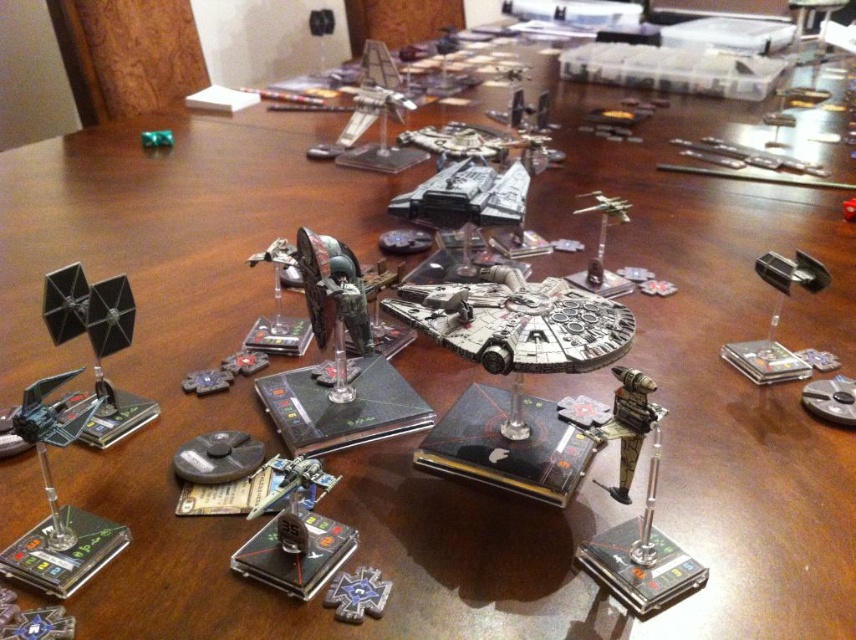
You are a player in a tabletop game who wants to move your metallic silver starfighter at upper right closer to the metallic silver star at center. The game rules state that each turn, your starfighter can move up to 0.5 meters. How many turns will it take to reach the star?

The metallic silver star at center and metallic silver starfighter at upper right are 1.06 meters apart from each other. Since the starfighter can move 0.5 meters per turn, it would take 3 turns to cover the distance. After 2 turns, it would have moved 1.0 meters, leaving 0.06 meters remaining, requiring a third turn to reach the star.

Based on the photo, you are a player in a Star Wars miniature game. Your metallic silver spaceship at lower left is positioned at coordinates 0.692, 0.061. If you want to move it to the center of the table, which direction should you move it?

The metallic silver spaceship at lower left is currently at coordinates (51,442). To move it to the center of the table, you should move it in the direction towards the upper center.

You are a player in a Star Wars tabletop game. Your spaceship, the metallic silver spaceship at lower left, is located at coordinates 0.692, 0.061. The game requires you to move your ship to the nearest corner of the table. Which corner should you move to?

The metallic silver spaceship at lower left is located at point (51, 442). The nearest corner would be the lower right corner since the x coordinate 0.692 is closer to 1 than to 0, and the y coordinate 0.061 is closer to 0 than to 1.